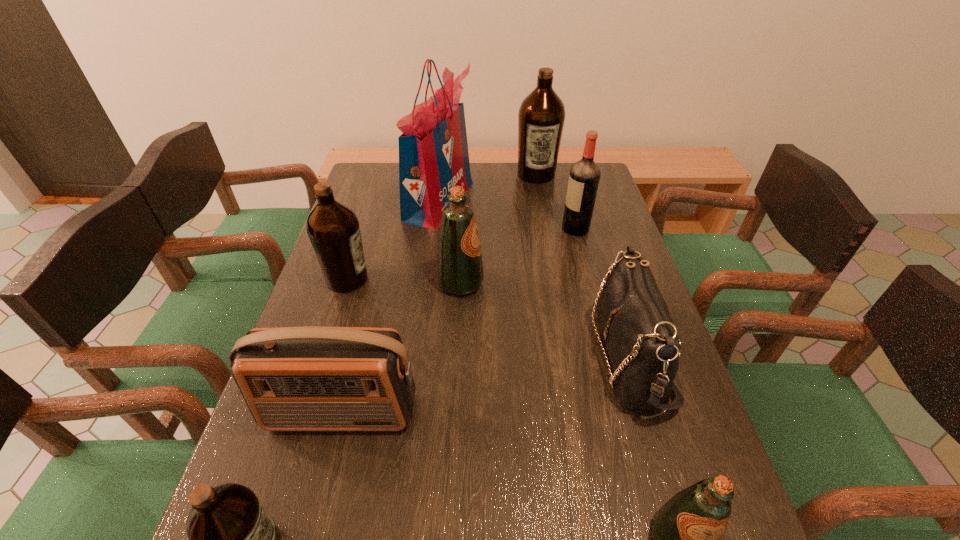
In the image, there is a desktop. Find the location of `free space at the left edge`. free space at the left edge is located at coordinates (341, 307).

The height and width of the screenshot is (540, 960). Find the location of `free region at the right edge`. free region at the right edge is located at coordinates (600, 272).

Image resolution: width=960 pixels, height=540 pixels. I want to click on vacant region between the left green olive oil and the liquor, so click(x=518, y=256).

In order to click on vacant area between the second biggest brown olive oil and the bigger green olive oil in this screenshot , I will do `click(404, 281)`.

Image resolution: width=960 pixels, height=540 pixels. What are the coordinates of `empty space that is in between the third olive oil from right to left and the liquor` in the screenshot? It's located at (518, 256).

I want to click on object that can be found as the eighth closest to the rightmost olive oil, so click(541, 116).

Identify which object is the fifth closest to the smaller green olive oil. Please provide its 2D coordinates. Your answer should be formatted as a tuple, i.e. [(x, y)], where the tuple contains the x and y coordinates of a point satisfying the conditions above.

[(584, 177)]

Locate an element on the screen. This screenshot has width=960, height=540. olive oil that stands as the third closest to the rightmost olive oil is located at coordinates (333, 228).

This screenshot has width=960, height=540. What are the coordinates of `the closest olive oil to the grocery bag` in the screenshot? It's located at (541, 116).

The width and height of the screenshot is (960, 540). In order to click on brown olive oil that stands as the second closest to the liquor in this screenshot , I will do `click(333, 228)`.